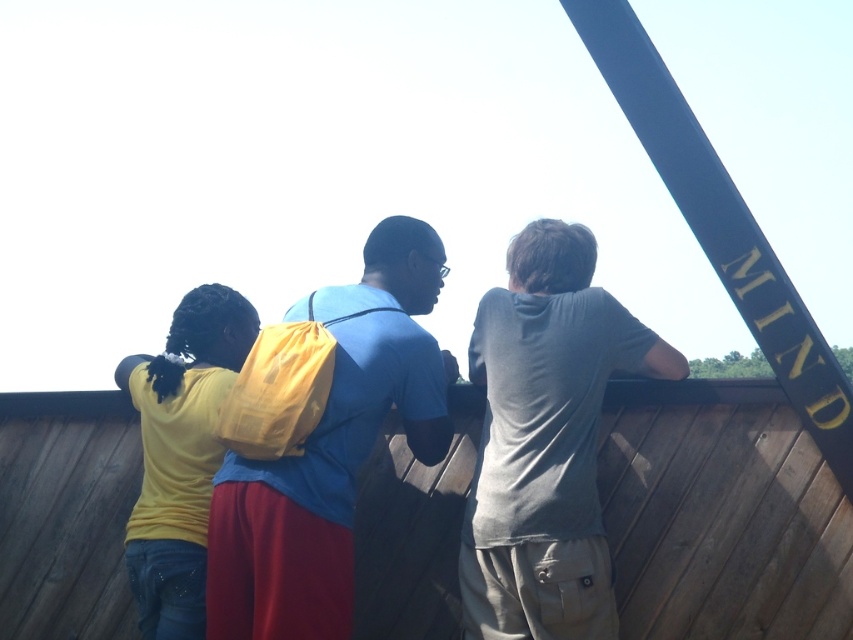
You are trying to determine the relative heights of the objects in the scene. Which object is shorter between the blue matte shirt at center and the yellow matte backpack at left?

The blue matte shirt at center is shorter than the yellow matte backpack at left.

You are a photographer trying to capture a photo of the gray cotton shirt at upper right and the blue matte shirt at center. Based on their positions, which one should you focus on first to ensure both are in frame?

The gray cotton shirt at upper right is located below the blue matte shirt at center, so you should focus on the blue matte shirt at center first to ensure both are in frame.